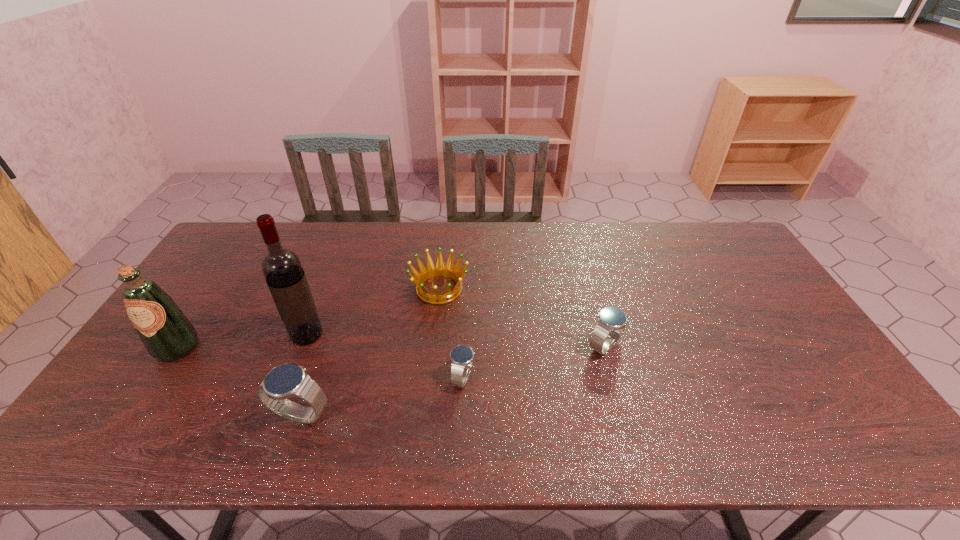
The image size is (960, 540). I want to click on vacant spot to place a watch on the right, so click(x=730, y=319).